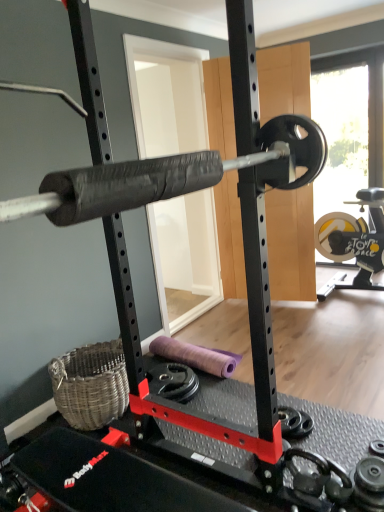
Question: From a real-world perspective, relative to transparent glass window at upper right, is black rubber dumbbell at lower right vertically above or below?

Choices:
 (A) below
 (B) above

Answer: (A)

Question: Does point (301, 437) appear closer or farther from the camera than point (382, 121)?

Choices:
 (A) closer
 (B) farther

Answer: (A)

Question: Is black rubber dumbbell at lower right in front of or behind transparent glass window at upper right in the image?

Choices:
 (A) behind
 (B) front

Answer: (B)

Question: Considering their positions, is transparent glass window at upper right located in front of or behind black rubber dumbbell at lower right?

Choices:
 (A) front
 (B) behind

Answer: (B)

Question: Considering the positions of transparent glass window at upper right and black rubber dumbbell at lower right in the image, is transparent glass window at upper right taller or shorter than black rubber dumbbell at lower right?

Choices:
 (A) tall
 (B) short

Answer: (A)

Question: Considering the relative positions of transparent glass window at upper right and black rubber dumbbell at lower right in the image provided, is transparent glass window at upper right to the left or to the right of black rubber dumbbell at lower right?

Choices:
 (A) right
 (B) left

Answer: (A)

Question: From a real-world perspective, is transparent glass window at upper right positioned above or below black rubber dumbbell at lower right?

Choices:
 (A) below
 (B) above

Answer: (B)